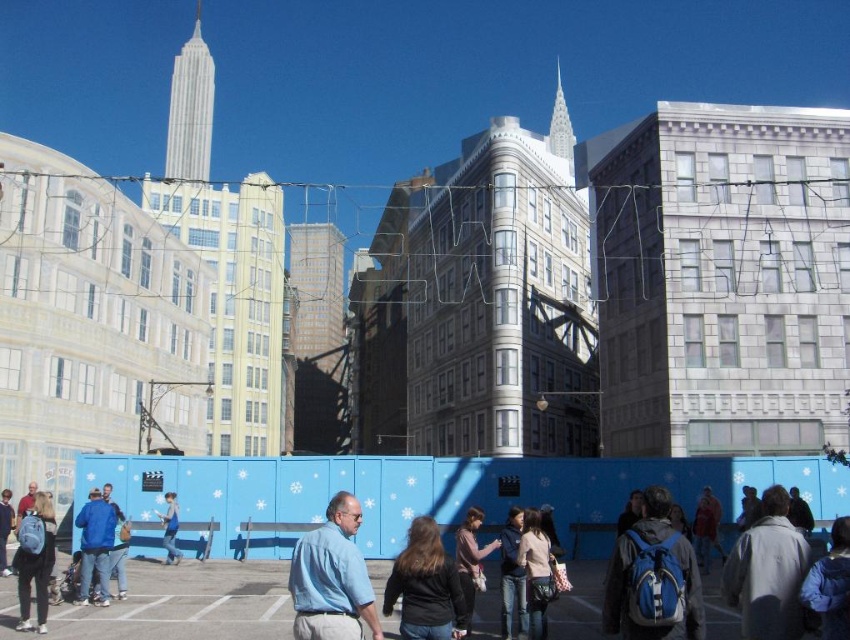
You are a photographer positioned at the edge of the scene, aiming to capture the Empire State Building through the transparent blue construction barrier. There is a person wearing a light blue shirt at center in your frame. Where should you adjust your camera to avoid the person while still keeping the skyscrapers in view?

The light blue shirt at center is located at point (332, 579), so you should adjust your camera slightly to the left or right of that coordinate to avoid the person while maintaining the skyscrapers in the background.

You are a photographer trying to capture a person wearing a light blue shirt at center and the light blue fabric at center in the same frame. Based on their positions, can you tell which one is closer to the camera?

The light blue shirt at center is above the light blue fabric at center, so the light blue shirt at center is closer to the camera.